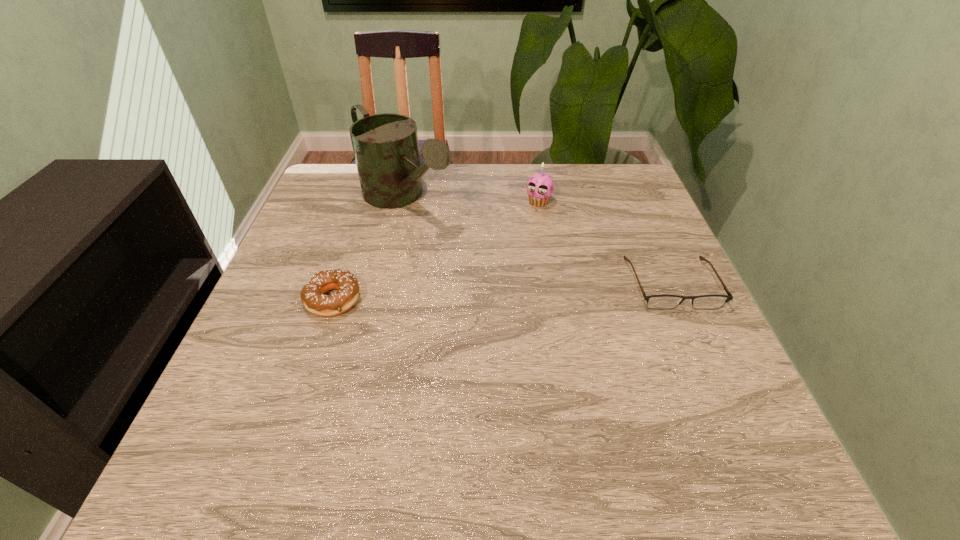
The width and height of the screenshot is (960, 540). In order to click on unoccupied area between the tallest object and the cupcake in this screenshot , I will do `click(471, 200)`.

Locate an element on the screen. The image size is (960, 540). empty space between the spectacles and the doughnut is located at coordinates (503, 291).

At what (x,y) coordinates should I click in order to perform the action: click on free spot between the tallest object and the third shortest object. Please return your answer as a coordinate pair (x, y). Looking at the image, I should click on (471, 200).

Locate an element on the screen. The image size is (960, 540). vacant space in between the third object from left to right and the spectacles is located at coordinates tap(605, 242).

Find the location of `free space between the third object from left to right and the shortest object`. free space between the third object from left to right and the shortest object is located at coordinates (605, 242).

Locate an element on the screen. free space that is in between the third object from left to right and the shortest object is located at coordinates (605, 242).

Locate which object ranks in proximity to the spectacles. Please provide its 2D coordinates. Your answer should be formatted as a tuple, i.e. [(x, y)], where the tuple contains the x and y coordinates of a point satisfying the conditions above.

[(540, 186)]

Locate an element on the screen. This screenshot has width=960, height=540. the third closest object to the cupcake is located at coordinates (312, 296).